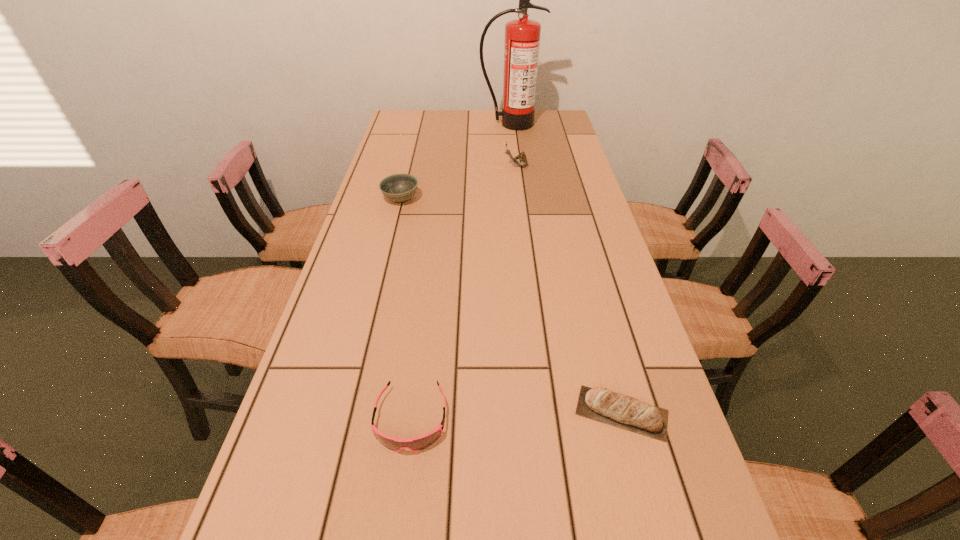
You are a GUI agent. You are given a task and a screenshot of the screen. Output one action in this format:
    pyautogui.click(x=<x>, y=<y>)
    Task: Click on the free point that satisfies the following two spatial constraints: 1. on the face of the snail; 2. on the front-facing side of the goggles
    The height and width of the screenshot is (540, 960).
    Given the screenshot: What is the action you would take?
    pyautogui.click(x=548, y=419)